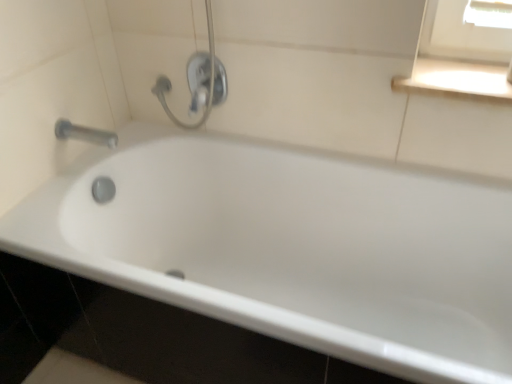
Question: Is white glossy bathtub at center behind white glossy window sill at upper right?

Choices:
 (A) no
 (B) yes

Answer: (A)

Question: Is white glossy bathtub at center facing towards white glossy window sill at upper right?

Choices:
 (A) yes
 (B) no

Answer: (B)

Question: From the image's perspective, does white glossy bathtub at center appear higher than white glossy window sill at upper right?

Choices:
 (A) yes
 (B) no

Answer: (B)

Question: From a real-world perspective, is white glossy bathtub at center below white glossy window sill at upper right?

Choices:
 (A) yes
 (B) no

Answer: (A)

Question: Can you confirm if white glossy bathtub at center is thinner than white glossy window sill at upper right?

Choices:
 (A) no
 (B) yes

Answer: (A)

Question: Can you confirm if white glossy bathtub at center is smaller than white glossy window sill at upper right?

Choices:
 (A) yes
 (B) no

Answer: (B)

Question: Can you confirm if satin nickel faucet at upper center is wider than white glossy bathtub at center?

Choices:
 (A) yes
 (B) no

Answer: (B)

Question: Is satin nickel faucet at upper center with white glossy bathtub at center?

Choices:
 (A) no
 (B) yes

Answer: (A)

Question: Can you confirm if satin nickel faucet at upper center is smaller than white glossy bathtub at center?

Choices:
 (A) no
 (B) yes

Answer: (B)

Question: Is satin nickel faucet at upper center thinner than white glossy bathtub at center?

Choices:
 (A) no
 (B) yes

Answer: (B)

Question: Are satin nickel faucet at upper center and white glossy bathtub at center far apart?

Choices:
 (A) no
 (B) yes

Answer: (A)

Question: From the image's perspective, is satin nickel faucet at upper center above white glossy bathtub at center?

Choices:
 (A) yes
 (B) no

Answer: (A)

Question: Is satin nickel faucet at upper center thinner than silver metallic tap at upper left?

Choices:
 (A) no
 (B) yes

Answer: (B)